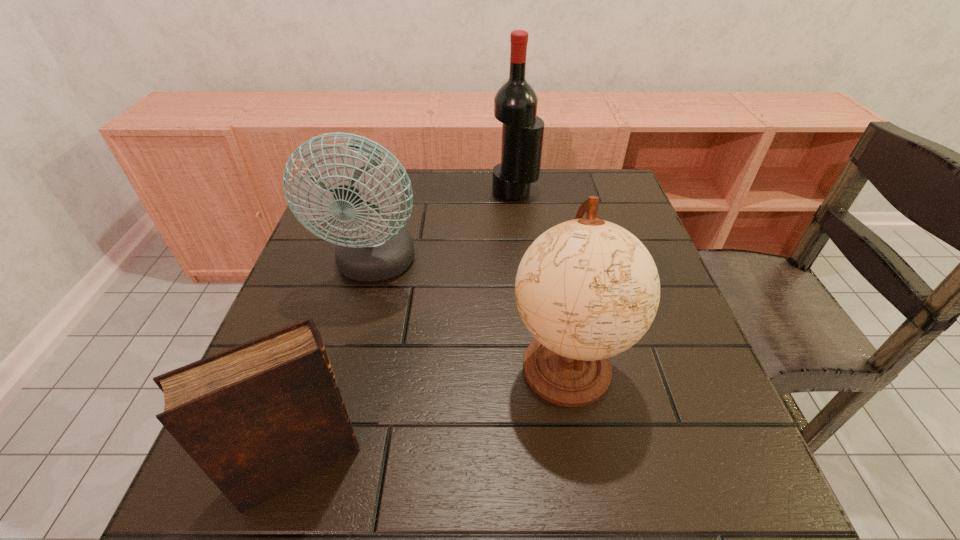
Image resolution: width=960 pixels, height=540 pixels. Identify the location of wine bottle. (515, 104).

What are the coordinates of `the farthest object` in the screenshot? It's located at (515, 104).

Identify the location of fan. (370, 249).

The image size is (960, 540). Find the location of `globe`. globe is located at coordinates (587, 289).

This screenshot has width=960, height=540. Identify the location of Bible. [x=258, y=418].

You are a GUI agent. You are given a task and a screenshot of the screen. Output one action in this format:
    pyautogui.click(x=<x>, y=<y>)
    Task: Click on the vacant region located on the right of the tallest object
    The width and height of the screenshot is (960, 540).
    Given the screenshot: What is the action you would take?
    pyautogui.click(x=587, y=192)

Locate an element on the screen. The width and height of the screenshot is (960, 540). free space located in front of the third nearest object where the airflow is directed is located at coordinates (333, 425).

This screenshot has height=540, width=960. Identify the location of free space located 0.120m on the surface of the globe. pyautogui.click(x=589, y=502).

This screenshot has width=960, height=540. I want to click on free space located on the right of the shortest object, so click(442, 464).

Where is `object present at the far edge`? Image resolution: width=960 pixels, height=540 pixels. object present at the far edge is located at coordinates (515, 104).